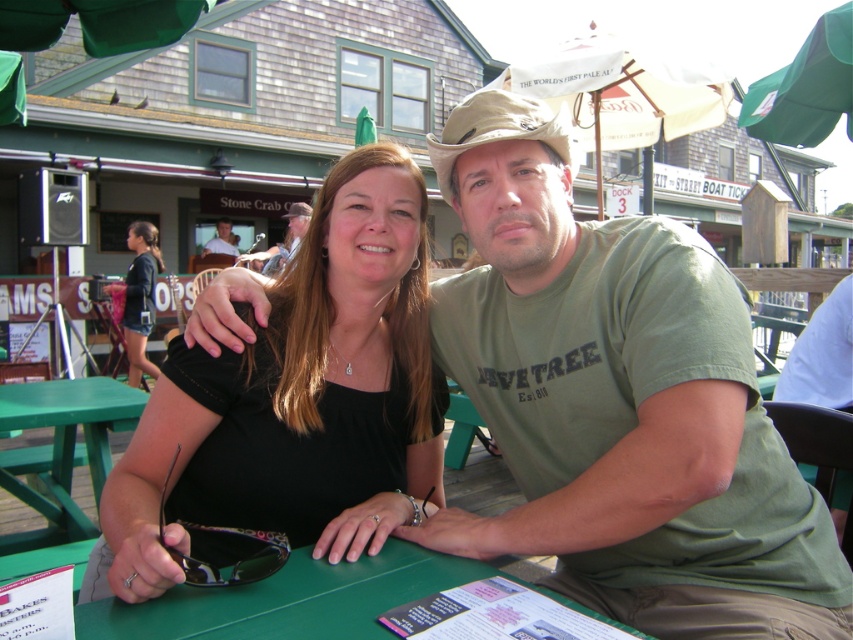
You are a server at the waterfront restaurant. You need to place a large tray of drinks on the green painted wood table at lower left and also need to set a small tip jar on the tan fabric cowboy hat at center. Which object can accommodate the larger item?

The green painted wood table at lower left is much taller than the tan fabric cowboy hat at center, so the larger tray of drinks should be placed on the green painted wood table at lower left while the smaller tip jar can go on the tan fabric cowboy hat at center.

Based on the photo, you are standing at the edge of the waterfront, and you want to place a 3.5 feet long picnic basket on the green plastic table at center. Can the picnic basket fit on the table without overhanging the edges?

The green plastic table at center is 3.32 feet away from the camera, but this distance does not provide information about the table size. Therefore, it is impossible to determine if the picnic basket will fit without knowing the table dimensions.